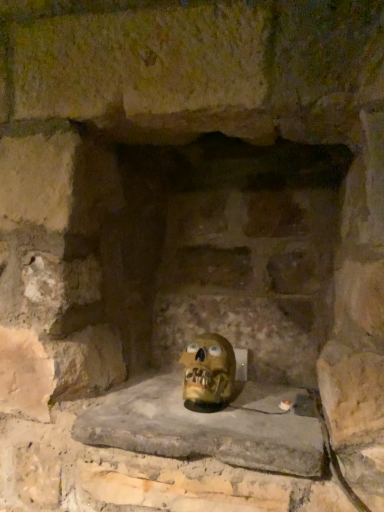
Question: In terms of width, does smooth stone window sill at center look wider or thinner when compared to matte yellow skull at center?

Choices:
 (A) wide
 (B) thin

Answer: (A)

Question: Does point (114, 430) appear closer or farther from the camera than point (215, 376)?

Choices:
 (A) farther
 (B) closer

Answer: (B)

Question: Is smooth stone window sill at center in front of or behind matte yellow skull at center in the image?

Choices:
 (A) behind
 (B) front

Answer: (B)

Question: Is matte yellow skull at center inside or outside of smooth stone window sill at center?

Choices:
 (A) outside
 (B) inside

Answer: (A)

Question: Looking at the image, does matte yellow skull at center seem bigger or smaller compared to smooth stone window sill at center?

Choices:
 (A) small
 (B) big

Answer: (A)

Question: Looking at their shapes, would you say matte yellow skull at center is wider or thinner than smooth stone window sill at center?

Choices:
 (A) wide
 (B) thin

Answer: (B)

Question: From the image's perspective, is matte yellow skull at center positioned above or below smooth stone window sill at center?

Choices:
 (A) above
 (B) below

Answer: (A)